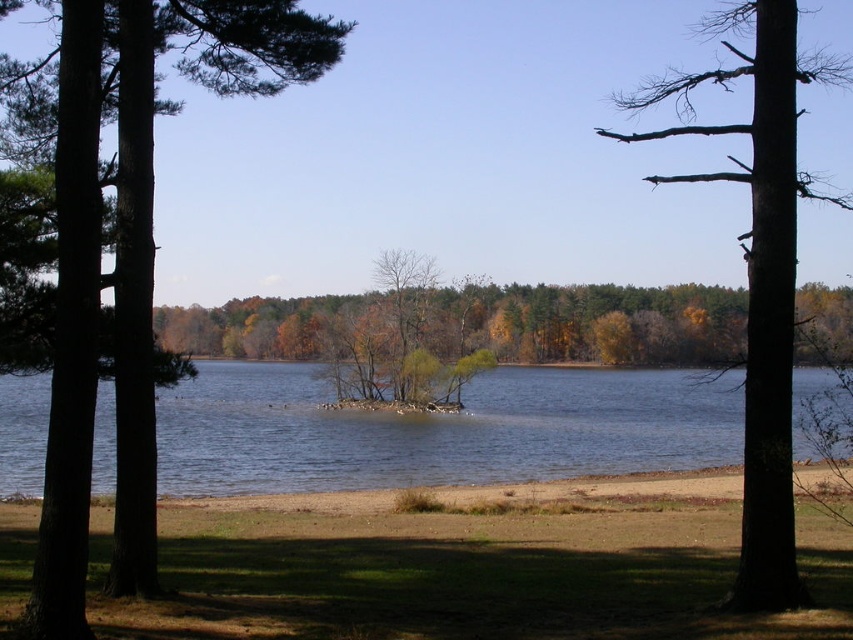
Question: Which object appears closest to the camera in this image?

Choices:
 (A) clear blue water at center
 (B) green matte tree at left
 (C) brown rough bark tree at right

Answer: (B)

Question: Can you confirm if green matte tree at left is wider than clear blue water at center?

Choices:
 (A) yes
 (B) no

Answer: (B)

Question: Can you confirm if green matte tree at left is positioned below brown rough bark tree at right?

Choices:
 (A) yes
 (B) no

Answer: (A)

Question: Is green matte tree at left below brown rough bark tree at right?

Choices:
 (A) yes
 (B) no

Answer: (A)

Question: Which point appears farthest from the camera in this image?

Choices:
 (A) 51,484
 (B) 770,493
 (C) 682,403

Answer: (C)

Question: Which of these objects is positioned farthest from the clear blue water at center?

Choices:
 (A) green matte tree at left
 (B) brown rough bark tree at right

Answer: (B)